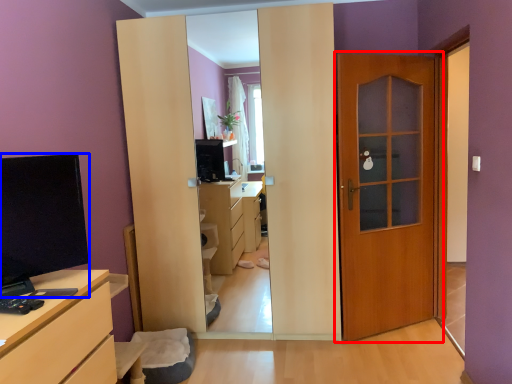
Question: Among these objects, which one is nearest to the camera, door (highlighted by a red box) or open (highlighted by a blue box)?

Choices:
 (A) door
 (B) open

Answer: (B)